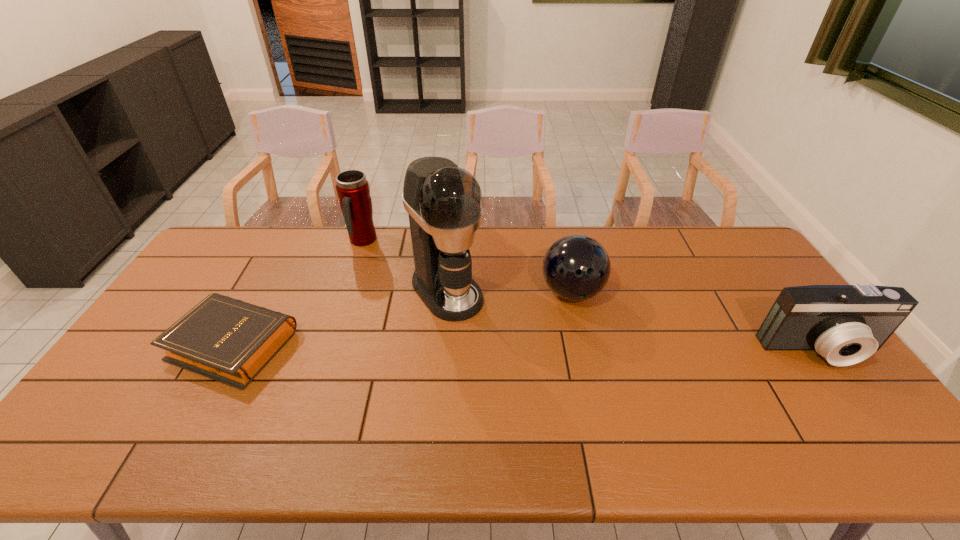
The width and height of the screenshot is (960, 540). Find the location of `vacant area located place cup under the spout of the coffee maker`. vacant area located place cup under the spout of the coffee maker is located at coordinates (546, 414).

At what (x,y) coordinates should I click in order to perform the action: click on vacant position located place cup under the spout of the coffee maker. Please return your answer as a coordinate pair (x, y). This screenshot has height=540, width=960. Looking at the image, I should click on (537, 402).

Image resolution: width=960 pixels, height=540 pixels. I want to click on free location located place cup under the spout of the coffee maker, so click(x=517, y=380).

At what (x,y) coordinates should I click in order to perform the action: click on vacant space located on the side of the second object from right to left with the finger holes. Please return your answer as a coordinate pair (x, y). This screenshot has height=540, width=960. Looking at the image, I should click on (623, 385).

I want to click on blank space located 0.170m on the side of the second object from right to left with the finger holes, so click(608, 358).

Identify the location of vacant region located 0.140m on the side of the second object from right to left with the finger holes. (604, 350).

Locate an element on the screen. This screenshot has height=540, width=960. vacant region located on the side with the handle of the fourth shortest object is located at coordinates (402, 298).

Locate an element on the screen. The image size is (960, 540). vacant space positioned on the side with the handle of the fourth shortest object is located at coordinates (391, 282).

Find the location of `vacant space located 0.330m on the side with the handle of the fourth shortest object`. vacant space located 0.330m on the side with the handle of the fourth shortest object is located at coordinates (408, 306).

Where is `coffee maker situated at the far edge`? This screenshot has width=960, height=540. coffee maker situated at the far edge is located at coordinates (444, 202).